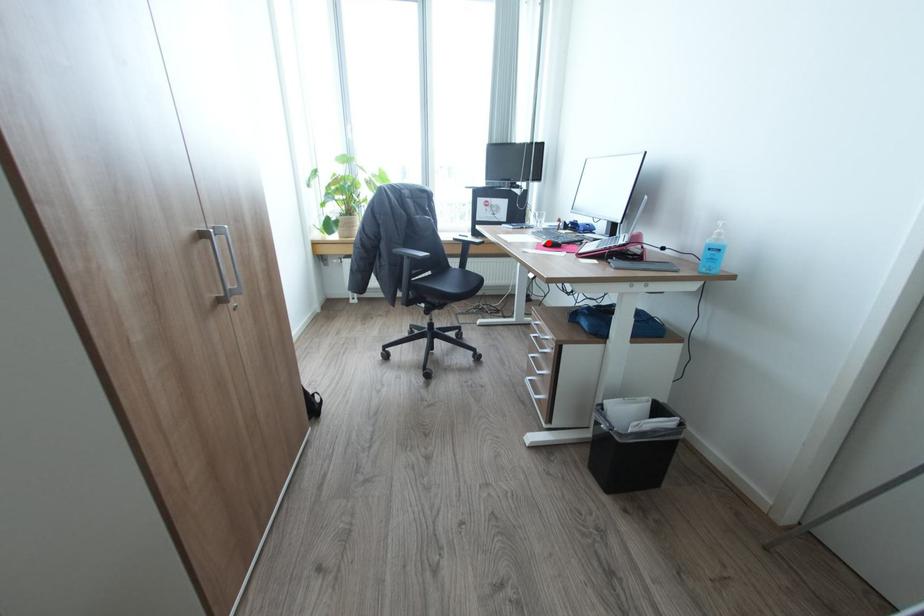
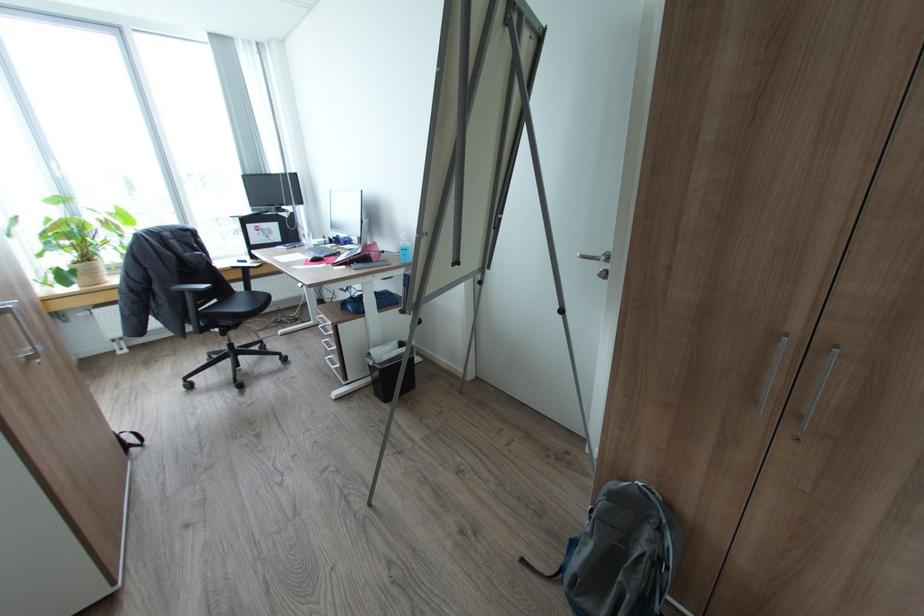
In the second image, find the point that corresponds to the highlighted location in the first image.

(314, 259)